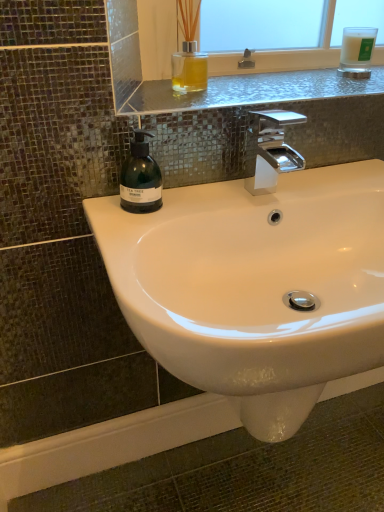
The height and width of the screenshot is (512, 384). I want to click on unoccupied region to the right of green matte soap dispenser at left, so click(208, 196).